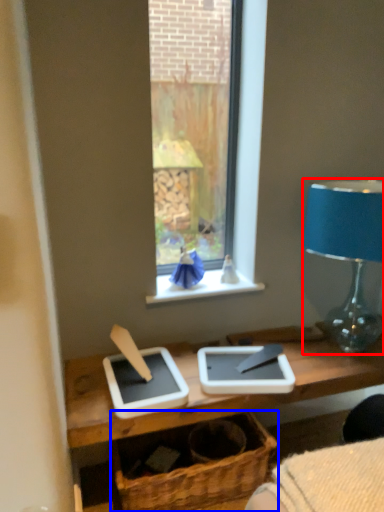
Question: Which of the following is the farthest to the observer, lamp (highlighted by a red box) or basket (highlighted by a blue box)?

Choices:
 (A) lamp
 (B) basket

Answer: (B)